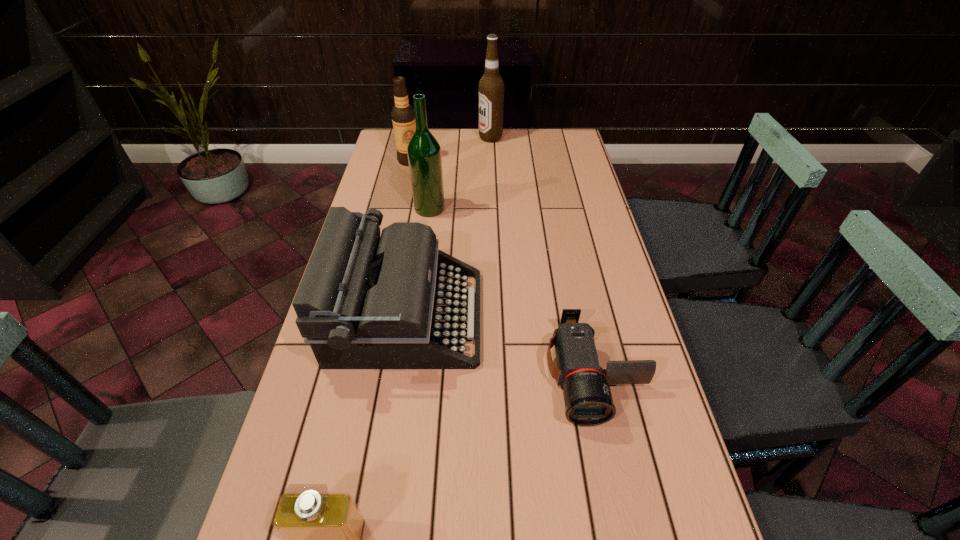
The width and height of the screenshot is (960, 540). Identify the location of vacant space that satisfies the following two spatial constraints: 1. on the label of the second farthest alcohol; 2. on the left side of the nearest alcohol. [398, 208].